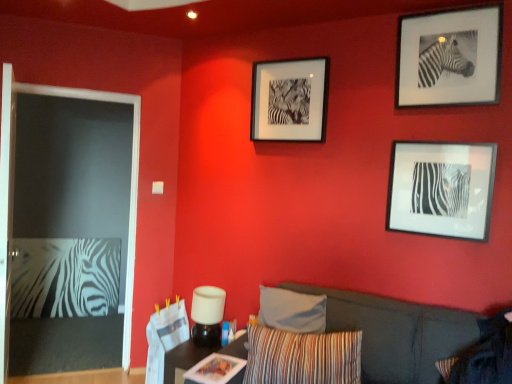
Question: Should I look upward or downward to see striped fabric pillow at lower right, the second pillow when ordered from left to right?

Choices:
 (A) up
 (B) down

Answer: (B)

Question: From a real-world perspective, is white matte lamp at center on top of black matte picture frame at upper right, the third picture frame viewed from the left?

Choices:
 (A) yes
 (B) no

Answer: (B)

Question: Does white matte lamp at center have a smaller size compared to black matte picture frame at upper right, the third picture frame viewed from the left?

Choices:
 (A) yes
 (B) no

Answer: (B)

Question: Does white matte lamp at center lie in front of black matte picture frame at upper right, arranged as the first picture frame when viewed from the right?

Choices:
 (A) no
 (B) yes

Answer: (A)

Question: Could black matte picture frame at upper right, arranged as the first picture frame when viewed from the right, be considered to be inside white matte lamp at center?

Choices:
 (A) yes
 (B) no

Answer: (B)

Question: Is white matte lamp at center at the left side of black matte picture frame at upper right, the third picture frame viewed from the left?

Choices:
 (A) yes
 (B) no

Answer: (A)

Question: Does white matte lamp at center turn towards black matte picture frame at upper right, the third picture frame viewed from the left?

Choices:
 (A) no
 (B) yes

Answer: (A)

Question: Could you tell me if black matte picture frame at upper right, the third picture frame viewed from the left, is turned towards dark gray fabric couch at center?

Choices:
 (A) yes
 (B) no

Answer: (B)

Question: Is black matte picture frame at upper right, the third picture frame viewed from the left, shorter than dark gray fabric couch at center?

Choices:
 (A) yes
 (B) no

Answer: (A)

Question: Considering the relative sizes of black matte picture frame at upper right, arranged as the first picture frame when viewed from the right, and dark gray fabric couch at center in the image provided, is black matte picture frame at upper right, arranged as the first picture frame when viewed from the right, thinner than dark gray fabric couch at center?

Choices:
 (A) yes
 (B) no

Answer: (A)

Question: Does black matte picture frame at upper right, arranged as the first picture frame when viewed from the right, come in front of dark gray fabric couch at center?

Choices:
 (A) yes
 (B) no

Answer: (B)

Question: Is black matte picture frame at upper right, the third picture frame viewed from the left, oriented away from dark gray fabric couch at center?

Choices:
 (A) yes
 (B) no

Answer: (B)

Question: Would you say black matte picture frame at upper right, arranged as the first picture frame when viewed from the right, is outside dark gray fabric couch at center?

Choices:
 (A) no
 (B) yes

Answer: (B)

Question: Could black matte picture frame at upper right, the third picture frame viewed from the left, be considered to be inside wooden table at lower center?

Choices:
 (A) yes
 (B) no

Answer: (B)